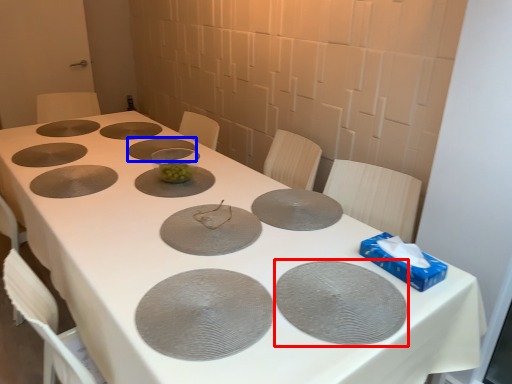
Question: Among these objects, which one is farthest to the camera, glass plate (highlighted by a red box) or glass plate (highlighted by a blue box)?

Choices:
 (A) glass plate
 (B) glass plate

Answer: (B)